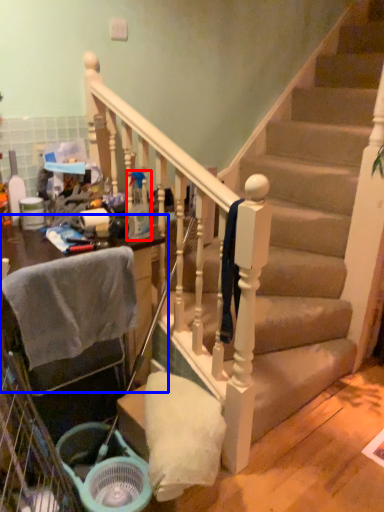
Question: Among these objects, which one is nearest to the camera, bottle (highlighted by a red box) or furniture (highlighted by a blue box)?

Choices:
 (A) bottle
 (B) furniture

Answer: (B)